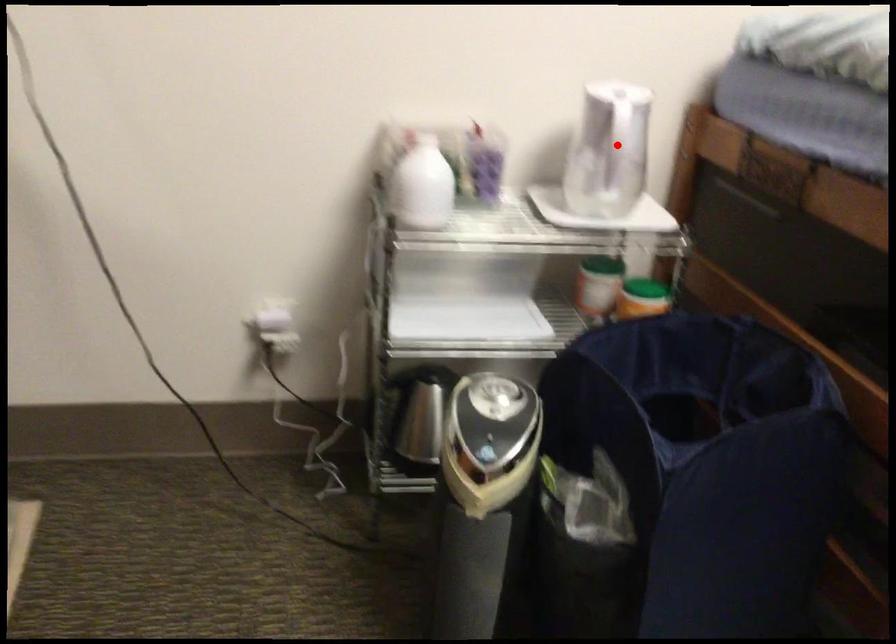
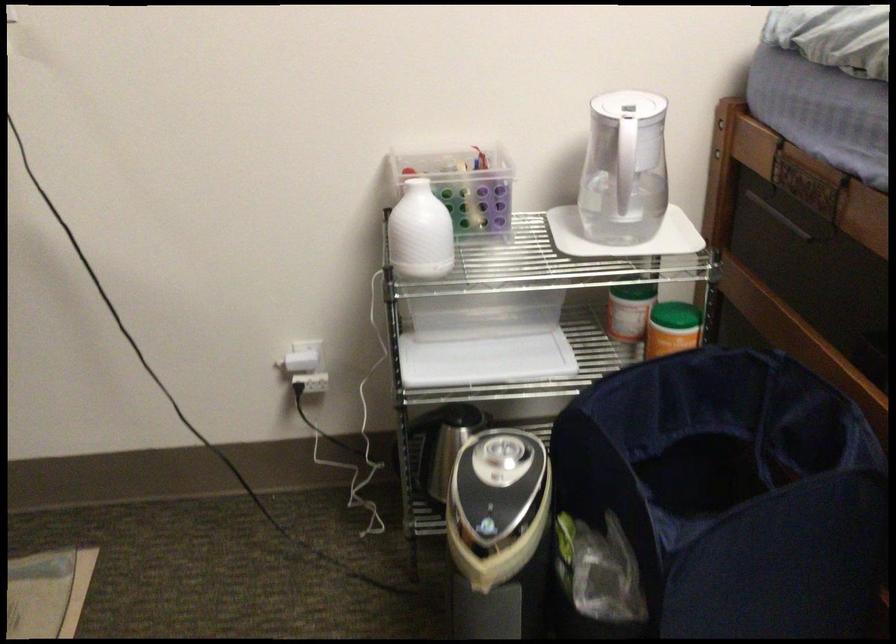
Where in the second image is the point corresponding to the highlighted location from the first image?

(625, 167)